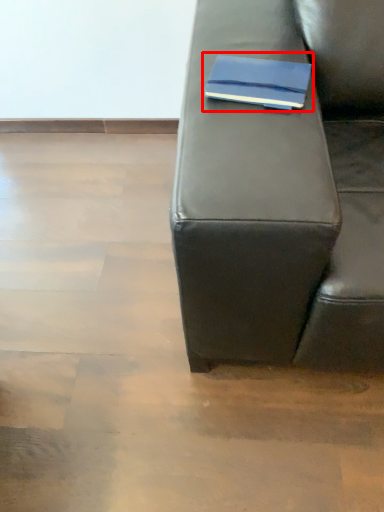
Question: From the image's perspective, what is the correct spatial relationship of paperback book (annotated by the red box) in relation to studio couch?

Choices:
 (A) above
 (B) below

Answer: (A)